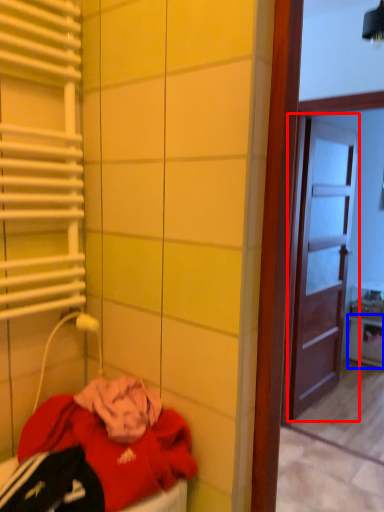
Question: Which object is further to the camera taking this photo, door (highlighted by a red box) or cabinetry (highlighted by a blue box)?

Choices:
 (A) door
 (B) cabinetry

Answer: (B)